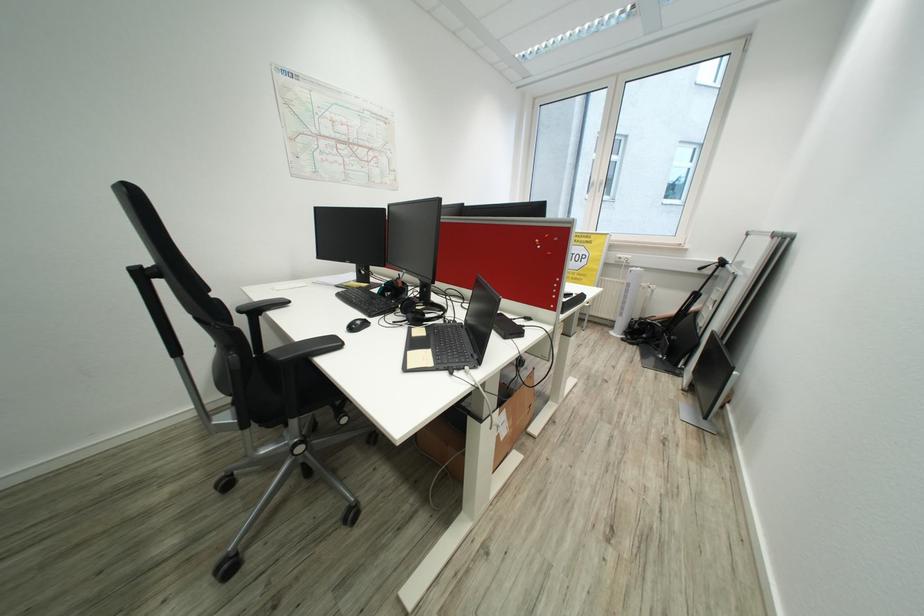
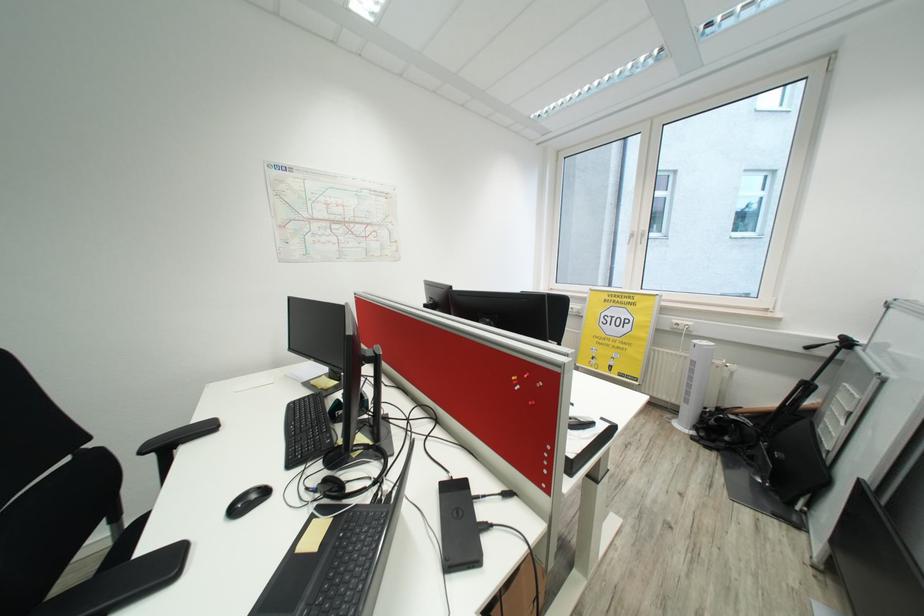
The images are taken continuously from a first-person perspective. In which direction are you moving?

The cameraman walked toward right, forward.